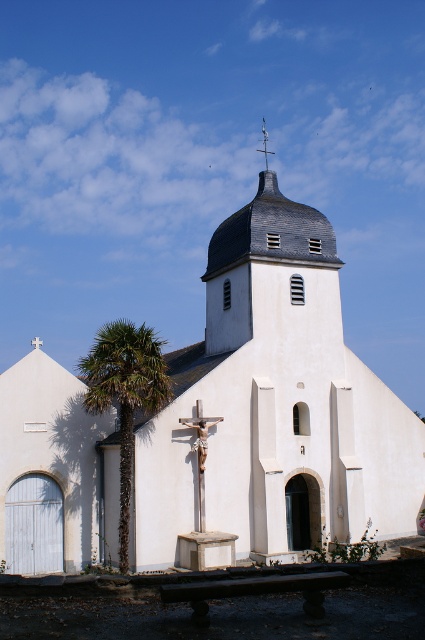
Is green leafy palm tree at left in front of polished silver spire at upper center?

Yes, green leafy palm tree at left is in front of polished silver spire at upper center.

Is green leafy palm tree at left shorter than polished silver spire at upper center?

Incorrect, green leafy palm tree at left's height does not fall short of polished silver spire at upper center's.

At what (x,y) coordinates should I click in order to perform the action: click on green leafy palm tree at left. Please return your answer as a coordinate pair (x, y). The width and height of the screenshot is (425, 640). Looking at the image, I should click on (124, 396).

Between point (265, 132) and point (39, 340), which one is positioned in front?

Point (39, 340) is in front.

Is point (266, 163) behind point (37, 339)?

No, it is in front of (37, 339).

Find the location of a particular element. polished silver spire at upper center is located at coordinates (265, 144).

Which is in front, point (269, 177) or point (266, 132)?

Positioned in front is point (269, 177).

Who is taller, white matte church at center or polished silver spire at upper center?

A: white matte church at center is taller.

Locate an element on the screen. Image resolution: width=425 pixels, height=640 pixels. white matte church at center is located at coordinates (217, 422).

Identify the location of white matte church at center. 217,422.